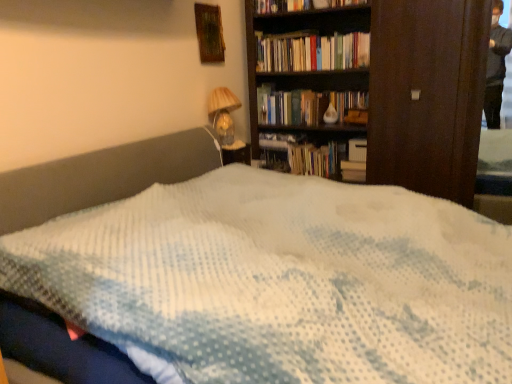
Question: Is matte glass table lamp at upper center facing away from wooden frame at upper center?

Choices:
 (A) yes
 (B) no

Answer: (B)

Question: From a real-world perspective, is matte glass table lamp at upper center below wooden frame at upper center?

Choices:
 (A) no
 (B) yes

Answer: (B)

Question: Can you see matte glass table lamp at upper center touching wooden frame at upper center?

Choices:
 (A) yes
 (B) no

Answer: (B)

Question: Considering the relative positions of matte glass table lamp at upper center and wooden frame at upper center in the image provided, is matte glass table lamp at upper center to the right of wooden frame at upper center from the viewer's perspective?

Choices:
 (A) yes
 (B) no

Answer: (A)

Question: Is matte glass table lamp at upper center taller than wooden frame at upper center?

Choices:
 (A) yes
 (B) no

Answer: (A)

Question: From a real-world perspective, is white matte paperback book at center-right positioned above or below hardcover books at upper center?

Choices:
 (A) above
 (B) below

Answer: (B)

Question: Looking at their shapes, would you say white matte paperback book at center-right is wider or thinner than hardcover books at upper center?

Choices:
 (A) wide
 (B) thin

Answer: (A)

Question: In the image, is white matte paperback book at center-right positioned in front of or behind hardcover books at upper center?

Choices:
 (A) behind
 (B) front

Answer: (A)

Question: Is white matte paperback book at center-right inside or outside of hardcover books at upper center?

Choices:
 (A) outside
 (B) inside

Answer: (A)

Question: Considering the relative positions of hardcover books at upper center and white matte paperback book at center-right in the image provided, is hardcover books at upper center to the left or to the right of white matte paperback book at center-right?

Choices:
 (A) left
 (B) right

Answer: (A)

Question: From the image's perspective, relative to white matte paperback book at center-right, is hardcover books at upper center above or below?

Choices:
 (A) below
 (B) above

Answer: (B)

Question: Is point (271, 59) positioned closer to the camera than point (350, 145)?

Choices:
 (A) closer
 (B) farther

Answer: (A)

Question: Considering the positions of hardcover books at upper center and white matte paperback book at center-right in the image, is hardcover books at upper center taller or shorter than white matte paperback book at center-right?

Choices:
 (A) short
 (B) tall

Answer: (B)

Question: Is white matte paperback book at center-right taller or shorter than matte glass table lamp at upper center?

Choices:
 (A) tall
 (B) short

Answer: (B)

Question: Is white matte paperback book at center-right spatially inside matte glass table lamp at upper center, or outside of it?

Choices:
 (A) outside
 (B) inside

Answer: (A)